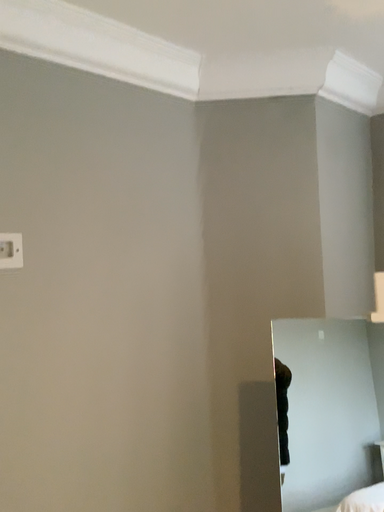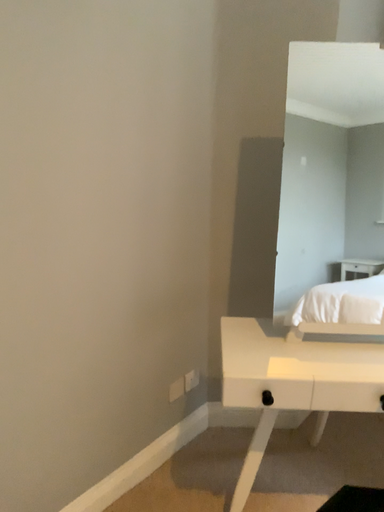
Question: How did the camera likely rotate when shooting the video?

Choices:
 (A) rotated downward
 (B) rotated upward

Answer: (A)